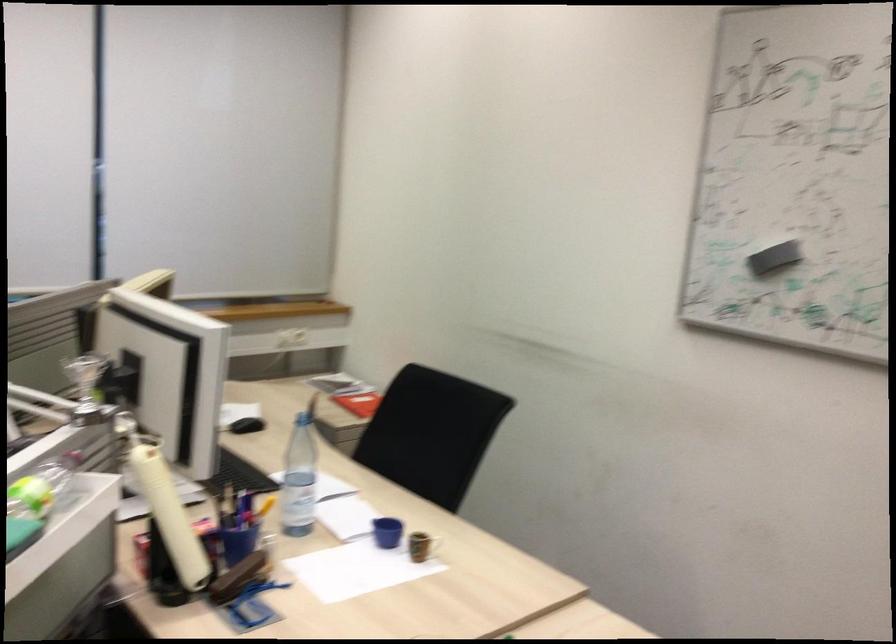
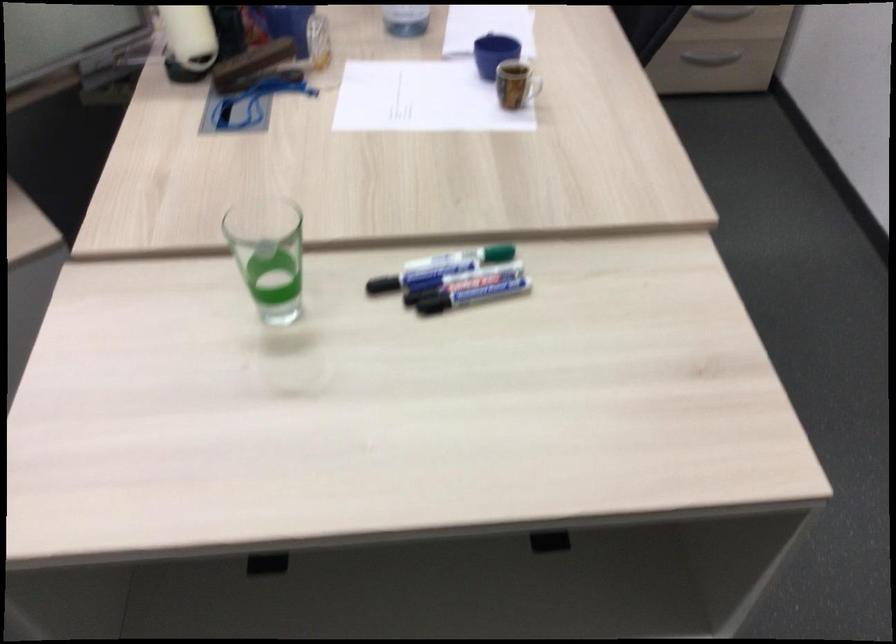
The point at (414, 536) is marked in the first image. Where is the corresponding point in the second image?

(531, 88)